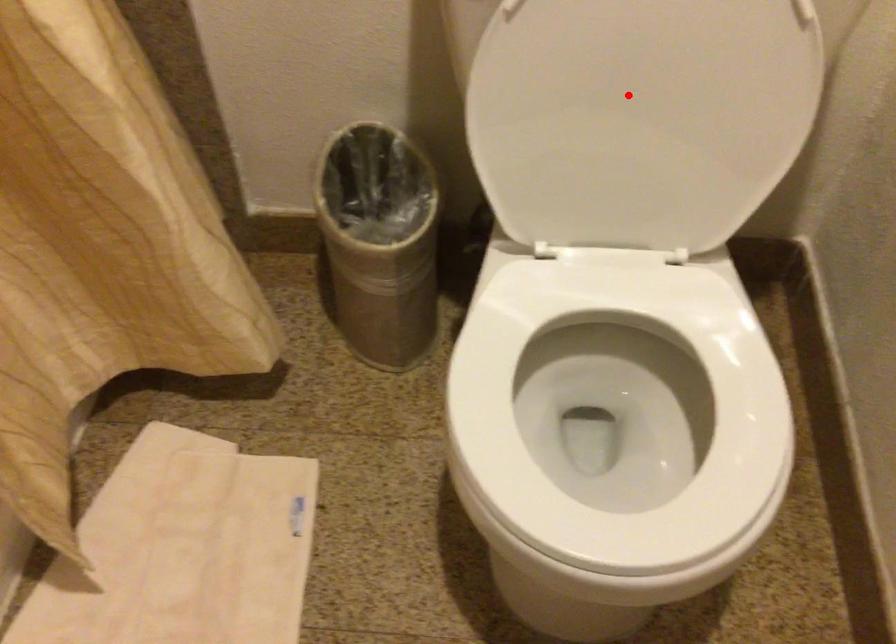
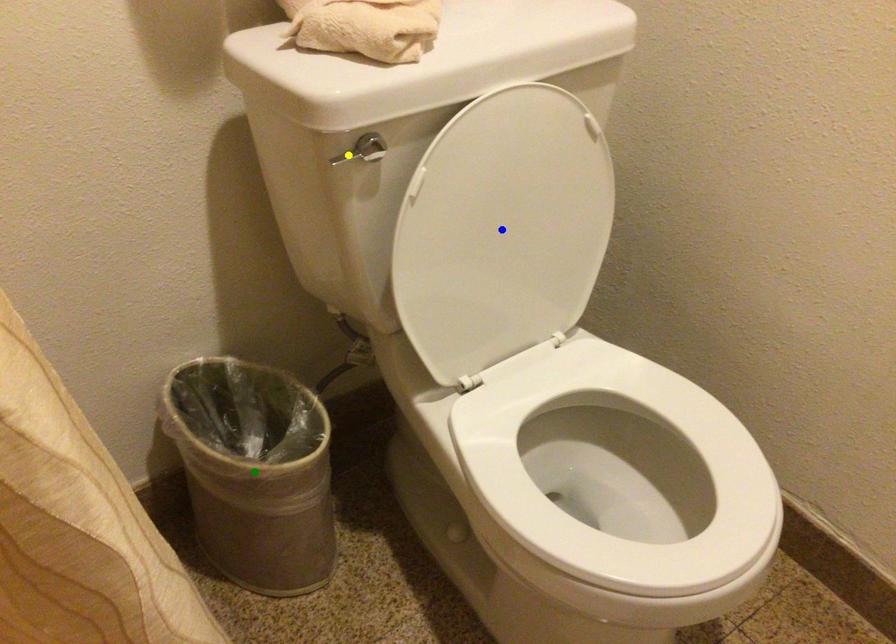
Question: I am providing you with two images of the same scene from different viewpoints. A red point is marked on the first image. You are given multiple points on the second image. Which spot in image 2 lines up with the point in image 1?

Choices:
 (A) yellow point
 (B) blue point
 (C) green point

Answer: (B)